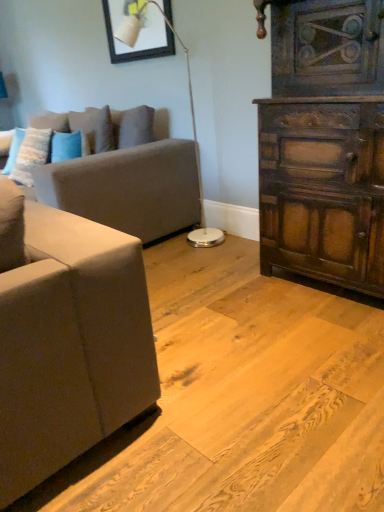
Locate an element on the screen. Image resolution: width=384 pixels, height=512 pixels. vacant area in front of dark brown wood chest of drawers at right is located at coordinates (316, 341).